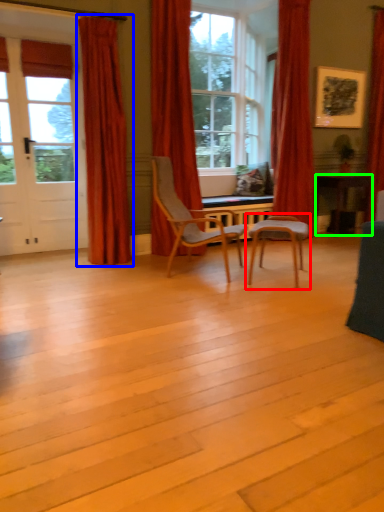
Question: Which object is the farthest from chair (highlighted by a red box)? Choose among these: curtain (highlighted by a blue box) or desk (highlighted by a green box).

Choices:
 (A) curtain
 (B) desk

Answer: (B)